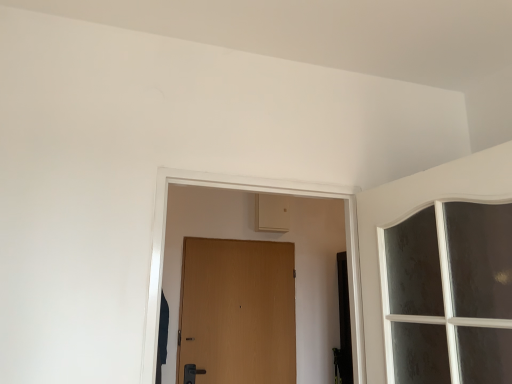
Question: Does wooden door at center have a larger size compared to white textured glass window at upper right?

Choices:
 (A) no
 (B) yes

Answer: (A)

Question: From the image's perspective, is wooden door at center beneath white textured glass window at upper right?

Choices:
 (A) no
 (B) yes

Answer: (B)

Question: Is wooden door at center positioned in front of white textured glass window at upper right?

Choices:
 (A) no
 (B) yes

Answer: (A)

Question: Considering the relative sizes of wooden door at center and white textured glass window at upper right in the image provided, is wooden door at center smaller than white textured glass window at upper right?

Choices:
 (A) no
 (B) yes

Answer: (B)

Question: Does wooden door at center have a greater width compared to white textured glass window at upper right?

Choices:
 (A) yes
 (B) no

Answer: (B)

Question: Is wooden door at center at the right side of white textured glass window at upper right?

Choices:
 (A) no
 (B) yes

Answer: (A)

Question: Considering the relative sizes of white textured glass window at upper right and wooden door at center in the image provided, is white textured glass window at upper right bigger than wooden door at center?

Choices:
 (A) no
 (B) yes

Answer: (B)

Question: Is white textured glass window at upper right behind wooden door at center?

Choices:
 (A) no
 (B) yes

Answer: (A)

Question: Is white textured glass window at upper right taller than wooden door at center?

Choices:
 (A) yes
 (B) no

Answer: (B)

Question: Does white textured glass window at upper right have a greater width compared to wooden door at center?

Choices:
 (A) yes
 (B) no

Answer: (A)

Question: Can you confirm if white textured glass window at upper right is thinner than wooden door at center?

Choices:
 (A) no
 (B) yes

Answer: (A)

Question: From a real-world perspective, is white textured glass window at upper right on wooden door at center?

Choices:
 (A) no
 (B) yes

Answer: (B)

Question: In terms of size, does white textured glass window at upper right appear bigger or smaller than wooden door at center?

Choices:
 (A) small
 (B) big

Answer: (B)